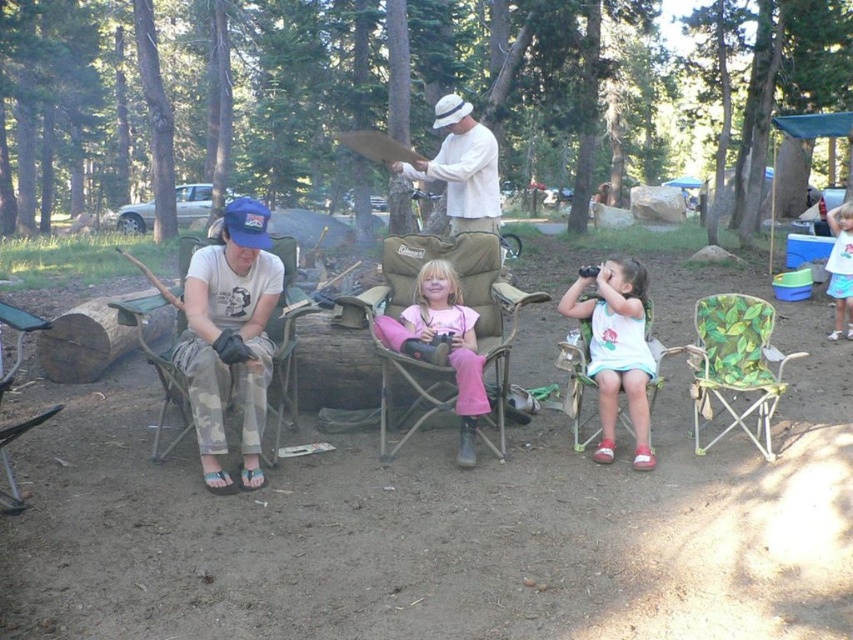
Is white cotton dress at center further to the viewer compared to pink fabric pants at center?

Yes, white cotton dress at center is further from the viewer.

Can you confirm if white cotton dress at center is positioned to the right of pink fabric pants at center?

Result: Indeed, white cotton dress at center is positioned on the right side of pink fabric pants at center.

Is point (601, 291) behind point (415, 298)?

No, (601, 291) is closer to viewer.

The height and width of the screenshot is (640, 853). Identify the location of white cotton dress at center. (616, 349).

Who is higher up, matte brown folding chair at center or camouflage fabric chair at left?

camouflage fabric chair at left is above.

Consider the image. Is matte brown folding chair at center positioned behind camouflage fabric chair at left?

Yes.

Who is more forward, (x=432, y=269) or (x=283, y=262)?

Point (x=432, y=269) is more forward.

The image size is (853, 640). I want to click on matte brown folding chair at center, so click(445, 324).

Between point (463, 221) and point (851, 301), which one is positioned in front?

Positioned in front is point (463, 221).

Can you confirm if white cotton shirt at center is positioned above white cotton shirt at lower right?

Correct, white cotton shirt at center is located above white cotton shirt at lower right.

Who is more distant from viewer, (473, 205) or (834, 298)?

Point (834, 298)

Find the location of a particular element. white cotton shirt at center is located at coordinates (461, 168).